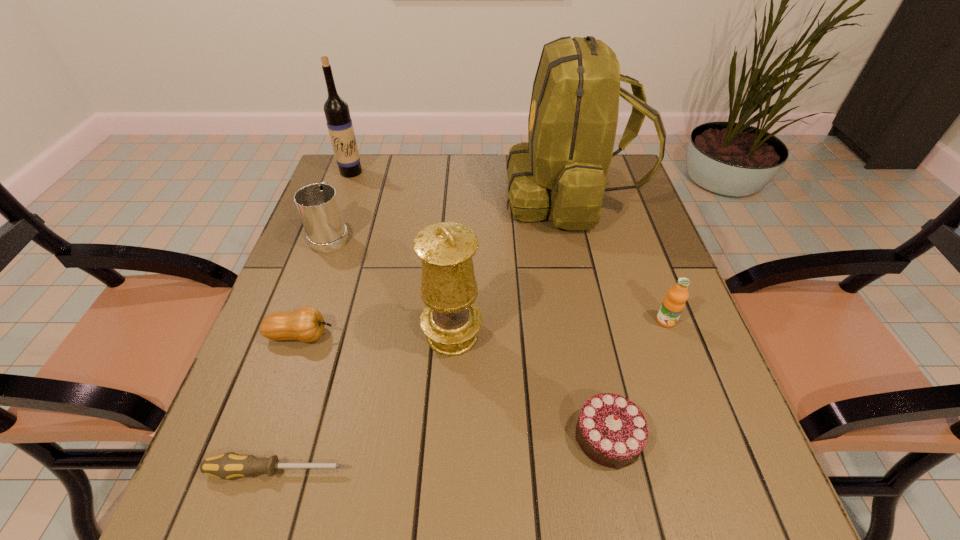
Where is `blank space that satisfies the following two spatial constraints: 1. on the stem side of the gourd; 2. on the back side of the chocolate cake`? blank space that satisfies the following two spatial constraints: 1. on the stem side of the gourd; 2. on the back side of the chocolate cake is located at coordinates (266, 437).

Identify the location of free location that satisfies the following two spatial constraints: 1. on the back side of the chocolate cake; 2. on the stem side of the gourd. Image resolution: width=960 pixels, height=540 pixels. (587, 335).

Where is `vacant space that satisfies the following two spatial constraints: 1. on the front side of the chocolate cake; 2. at the tip of the screwdriver`? The height and width of the screenshot is (540, 960). vacant space that satisfies the following two spatial constraints: 1. on the front side of the chocolate cake; 2. at the tip of the screwdriver is located at coordinates (614, 471).

Locate an element on the screen. This screenshot has height=540, width=960. vacant region that satisfies the following two spatial constraints: 1. on the label of the orange juice; 2. at the tip of the shortest object is located at coordinates (722, 471).

The image size is (960, 540). Find the location of `vacant space that satisfies the following two spatial constraints: 1. on the label of the orange juice; 2. at the tip of the shortest object`. vacant space that satisfies the following two spatial constraints: 1. on the label of the orange juice; 2. at the tip of the shortest object is located at coordinates (722, 471).

I want to click on free location that satisfies the following two spatial constraints: 1. on the back side of the chocolate cake; 2. on the stem side of the gourd, so click(x=587, y=335).